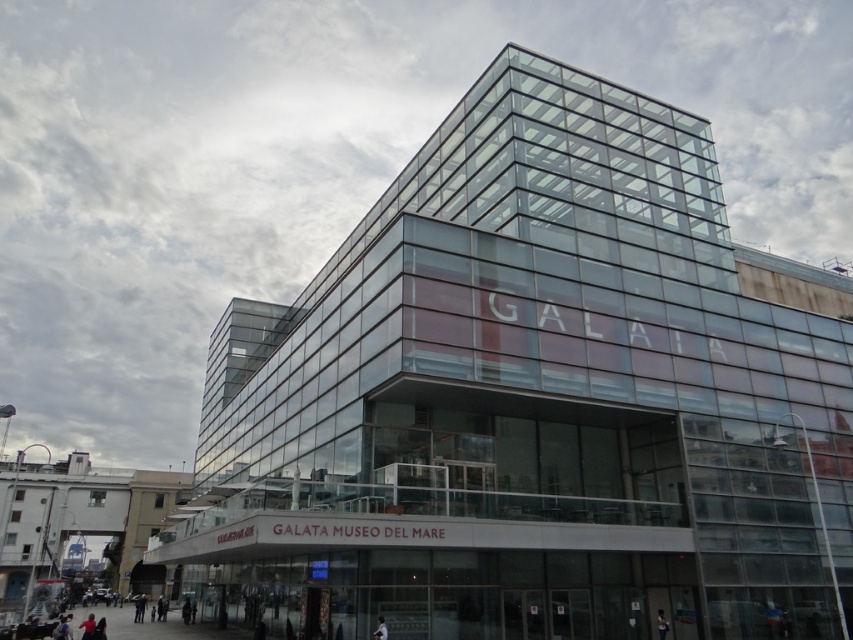
Is light brown leather jacket at lower right below dark gray jacket at lower center?

No, light brown leather jacket at lower right is not below dark gray jacket at lower center.

Is light brown leather jacket at lower right smaller than dark gray jacket at lower center?

Indeed, light brown leather jacket at lower right has a smaller size compared to dark gray jacket at lower center.

In order to click on light brown leather jacket at lower right in this screenshot , I will do `click(660, 625)`.

Is point (138, 602) farther from camera compared to point (90, 630)?

Yes, it is behind point (90, 630).

Between dark blue jeans at lower center and dark blue jeans at lower left, which one is positioned lower?

dark blue jeans at lower center

Between point (136, 609) and point (90, 637), which one is positioned behind?

The point (136, 609) is behind.

Locate an element on the screen. Image resolution: width=853 pixels, height=640 pixels. dark blue jeans at lower center is located at coordinates (138, 608).

Looking at this image, does dark blue jeans at lower left have a greater height compared to light brown leather jacket at lower center?

Yes.

Can you confirm if dark blue jeans at lower left is smaller than light brown leather jacket at lower center?

Incorrect, dark blue jeans at lower left is not smaller in size than light brown leather jacket at lower center.

Locate an element on the screen. Image resolution: width=853 pixels, height=640 pixels. dark blue jeans at lower left is located at coordinates (86, 627).